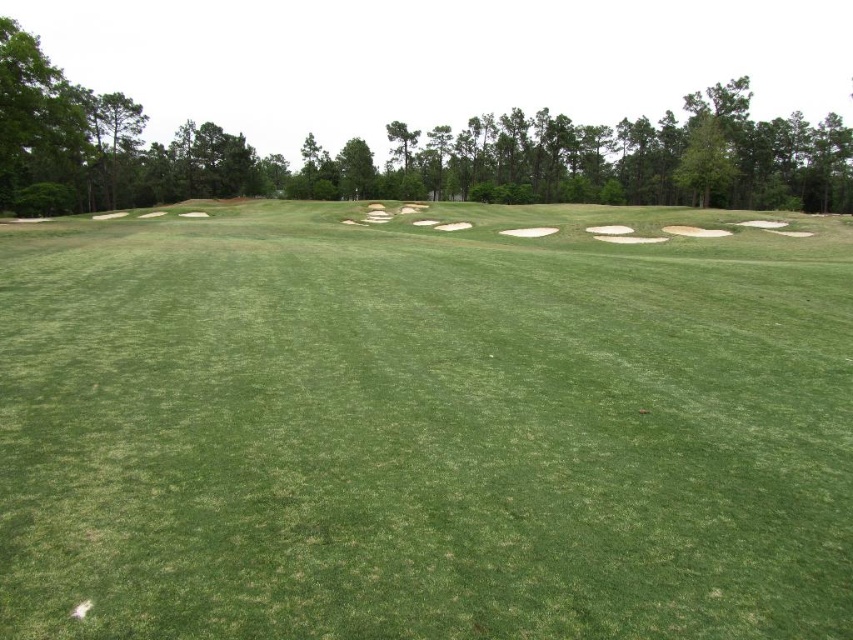
Does green grassy field at center appear on the left side of white sand bunker at center?

Indeed, green grassy field at center is positioned on the left side of white sand bunker at center.

Who is more forward, (697, 396) or (521, 230)?

Positioned in front is point (697, 396).

Identify the location of green grassy field at center. The width and height of the screenshot is (853, 640). pos(424,426).